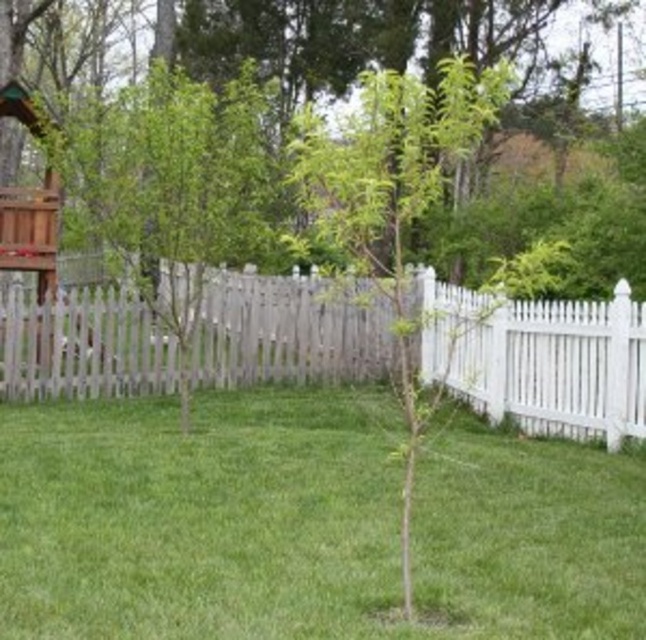
You are planning to plant a new flower bed in the backyard. You need to know which area has more space between the green grass at center and the green leafy tree at center. Which one has a wider area?

The green leafy tree at center has a wider area compared to the green grass at center.

You are standing in the backyard and want to place a small garden ornament between the two points labeled point (x=171, y=605) and point (x=182, y=118). Based on their positions, which point is closer to you where you should start placing the ornament?

Point (x=171, y=605) is closer to the viewer than point (x=182, y=118), so you should start placing the ornament near point (x=171, y=605) since it is closer.

You are a gardener who wants to plant a new flower that requires at least 30 cm of space above it to grow properly. You have two options in the scene to place it. One is near the green grass at center, and the other is near the green leafy tree at center. Based on their heights, which location would allow the flower to have enough vertical space to grow?

The green grass at center has a lesser height compared to the green leafy tree at center. Therefore, placing the flower near the green grass at center would provide more vertical space for the flower to grow since the grass is shorter than the tree.